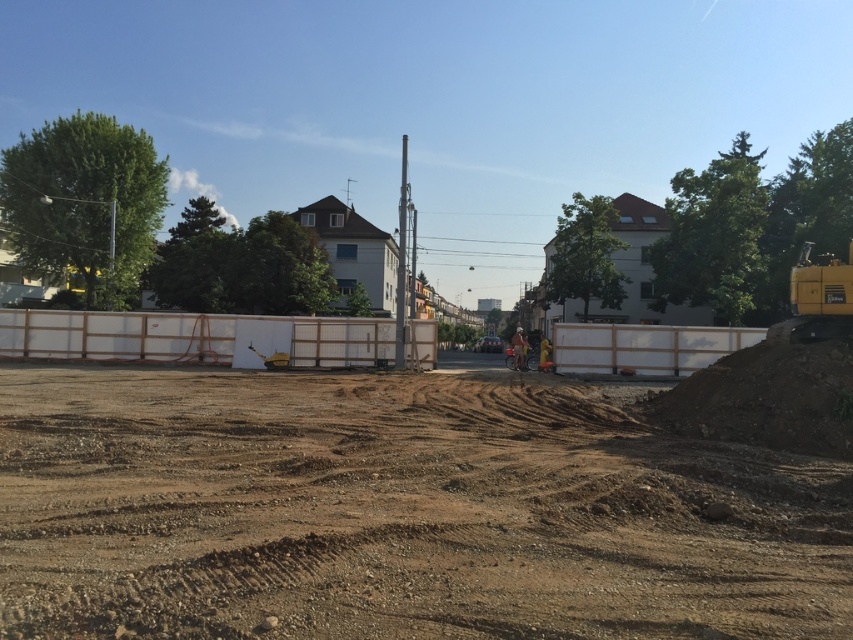
You are standing at the point marked by the coordinates point (195,337). What object are you directly facing?

The point (195,337) indicates the location of the white wooden fence at center, so you are directly facing the white wooden fence at center.

You are a delivery truck driver who needs to unload supplies at the construction site. The truck requires a minimum of 20 meters of clear space to maneuver safely. Based on the scene, can you safely maneuver the truck between the brown sandy dirt at center and the white plastic barrier at center?

The brown sandy dirt at center and white plastic barrier at center are 19.74 meters apart from each other, which is less than the required 20 meters. Therefore, the truck cannot safely maneuver between them due to insufficient space.